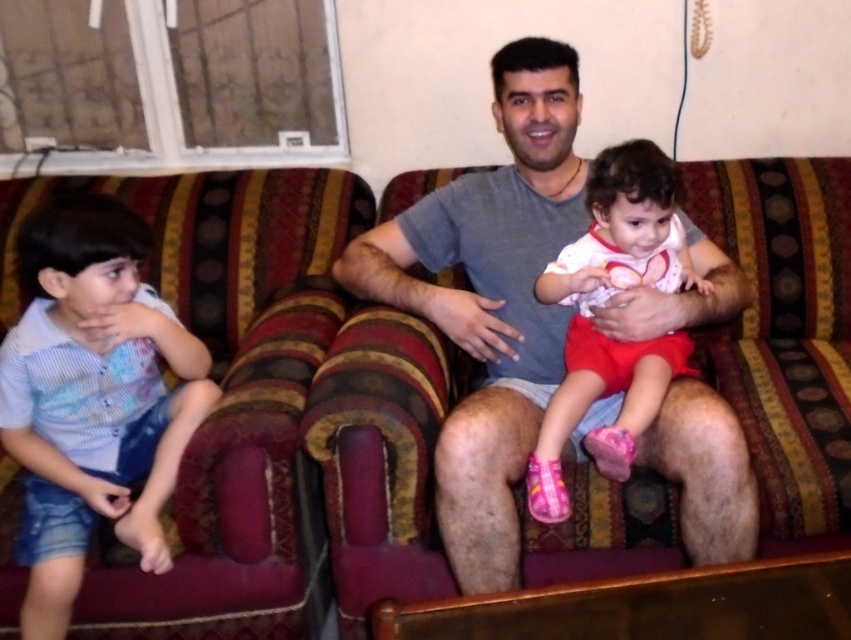
Question: Based on their relative distances, which object is farther from the blue striped shirt at left?

Choices:
 (A) matte white shirt at center
 (B) gray cotton shirt at center

Answer: (A)

Question: Which point is closer to the camera taking this photo?

Choices:
 (A) (577, 157)
 (B) (637, 228)
 (C) (149, 316)

Answer: (B)

Question: Can you confirm if blue striped shirt at left is wider than matte white shirt at center?

Choices:
 (A) yes
 (B) no

Answer: (B)

Question: Which point is closer to the camera?

Choices:
 (A) gray cotton shirt at center
 (B) matte white shirt at center

Answer: (A)

Question: Considering the relative positions of gray cotton shirt at center and matte white shirt at center in the image provided, where is gray cotton shirt at center located with respect to matte white shirt at center?

Choices:
 (A) right
 (B) left

Answer: (B)

Question: Is blue striped shirt at left wider than matte white shirt at center?

Choices:
 (A) yes
 (B) no

Answer: (B)